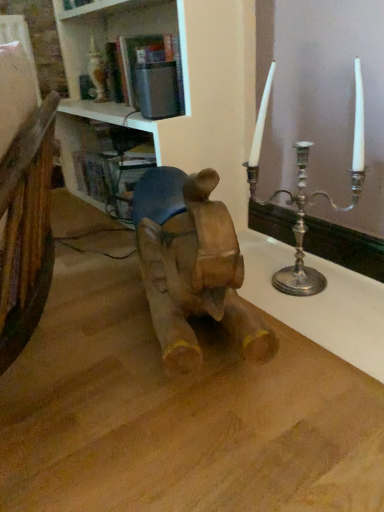
You are a GUI agent. You are given a task and a screenshot of the screen. Output one action in this format:
    pyautogui.click(x=<x>, y=<y>)
    Task: Click on the vacant area that lies in front of silver metallic candlestick at upper right
    The height and width of the screenshot is (512, 384).
    Given the screenshot: What is the action you would take?
    pyautogui.click(x=319, y=328)